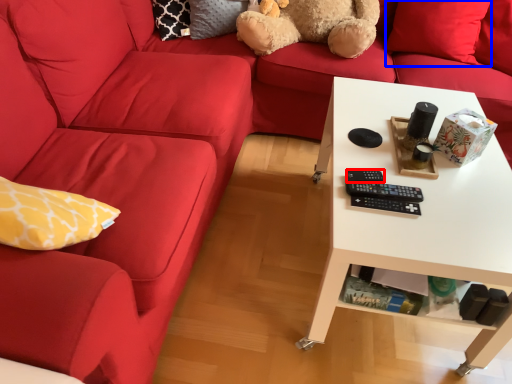
Question: Which object is closer to the camera taking this photo, control (highlighted by a red box) or pillow (highlighted by a blue box)?

Choices:
 (A) control
 (B) pillow

Answer: (A)